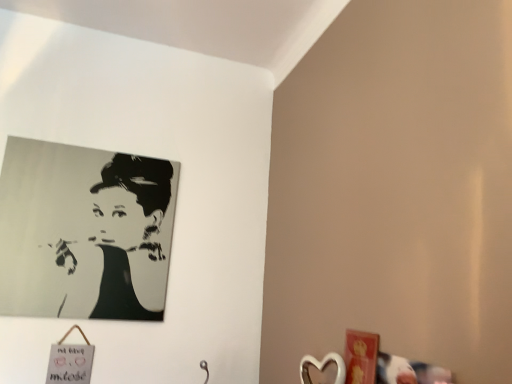
Question: Do you think black matte portrait at upper left is within metallic silver heart at lower right, or outside of it?

Choices:
 (A) inside
 (B) outside

Answer: (B)

Question: Is point 104,180 closer or farther from the camera than point 306,354?

Choices:
 (A) closer
 (B) farther

Answer: (B)

Question: In terms of width, does black matte portrait at upper left look wider or thinner when compared to metallic silver heart at lower right?

Choices:
 (A) thin
 (B) wide

Answer: (A)

Question: From their relative heights in the image, would you say metallic silver heart at lower right is taller or shorter than black matte portrait at upper left?

Choices:
 (A) tall
 (B) short

Answer: (B)

Question: From a real-world perspective, is metallic silver heart at lower right positioned above or below black matte portrait at upper left?

Choices:
 (A) below
 (B) above

Answer: (A)

Question: Considering the positions of point (335, 362) and point (124, 182), is point (335, 362) closer or farther from the camera than point (124, 182)?

Choices:
 (A) closer
 (B) farther

Answer: (A)

Question: Is metallic silver heart at lower right inside or outside of black matte portrait at upper left?

Choices:
 (A) outside
 (B) inside

Answer: (A)